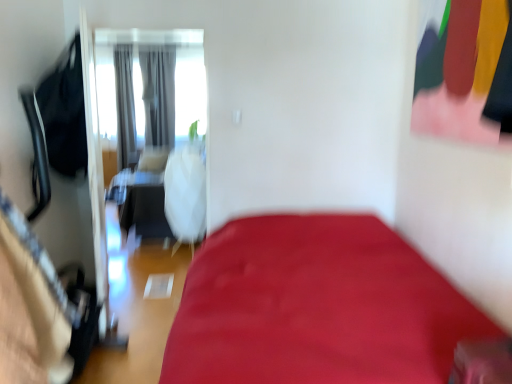
In order to face gray fabric curtain at center, the 1th curtain viewed from the right, should I rotate leftwards or rightwards?

To align with it, rotate left about 13.038°.

In the scene shown: What is the approximate height of gray fabric curtain at center, the 2th curtain in the left-to-right sequence?

The height of gray fabric curtain at center, the 2th curtain in the left-to-right sequence, is 5.85 feet.

I want to click on gray fabric curtain at center, the 1th curtain viewed from the right, so click(x=158, y=93).

From the image's perspective, relative to gray fabric curtain at center, the 2th curtain in the left-to-right sequence, is gray fabric curtain at upper left, the 1th curtain in the left-to-right sequence, above or below?

From the image's perspective, gray fabric curtain at upper left, the 1th curtain in the left-to-right sequence, appears below gray fabric curtain at center, the 2th curtain in the left-to-right sequence.

Can you see gray fabric curtain at upper left, which appears as the 2th curtain when viewed from the right, touching gray fabric curtain at center, the 2th curtain in the left-to-right sequence?

No, gray fabric curtain at upper left, which appears as the 2th curtain when viewed from the right, is not next to gray fabric curtain at center, the 2th curtain in the left-to-right sequence.

Considering the relative positions of gray fabric curtain at upper left, which appears as the 2th curtain when viewed from the right, and gray fabric curtain at center, the 2th curtain in the left-to-right sequence, in the image provided, is gray fabric curtain at upper left, which appears as the 2th curtain when viewed from the right, to the left or to the right of gray fabric curtain at center, the 2th curtain in the left-to-right sequence,?

gray fabric curtain at upper left, which appears as the 2th curtain when viewed from the right, is to the left of gray fabric curtain at center, the 2th curtain in the left-to-right sequence.

At what (x,y) coordinates should I click in order to perform the action: click on curtain on the right of gray fabric curtain at upper left, the 1th curtain in the left-to-right sequence. Please return your answer as a coordinate pair (x, y). Looking at the image, I should click on (158, 93).

From the image's perspective, does matte black clothing at upper right appear lower than white matte screen door at upper left?

No, from the image's perspective, matte black clothing at upper right is not beneath white matte screen door at upper left.

Is matte black clothing at upper right far away from white matte screen door at upper left?

Indeed, matte black clothing at upper right is not near white matte screen door at upper left.

What's the angular difference between matte black clothing at upper right and white matte screen door at upper left's facing directions?

The angle between the facing direction of matte black clothing at upper right and the facing direction of white matte screen door at upper left is 89.9 degrees.

Which of these two, matte black clothing at upper right or white matte screen door at upper left, is smaller?

Smaller between the two is matte black clothing at upper right.

Consider the image. Can you tell me how much matte black clothing at upper right and gray fabric curtain at center, the 2th curtain in the left-to-right sequence, differ in facing direction?

The angle between the facing direction of matte black clothing at upper right and the facing direction of gray fabric curtain at center, the 2th curtain in the left-to-right sequence, is 93.3 degrees.

From a real-world perspective, who is located higher, matte black clothing at upper right or gray fabric curtain at center, the 2th curtain in the left-to-right sequence?

From a 3D spatial view, matte black clothing at upper right is above.

This screenshot has height=384, width=512. What are the coordinates of `the 1st curtain below the matte black clothing at upper right (from a real-world perspective)` in the screenshot? It's located at (158, 93).

In the scene shown: Is matte black clothing at upper right inside the boundaries of gray fabric curtain at center, the 1th curtain viewed from the right, or outside?

matte black clothing at upper right is not inside gray fabric curtain at center, the 1th curtain viewed from the right, it's outside.

From the image's perspective, would you say gray fabric curtain at center, the 2th curtain in the left-to-right sequence, is shown under gray fabric curtain at upper left, the 1th curtain in the left-to-right sequence?

No, from the image's perspective, gray fabric curtain at center, the 2th curtain in the left-to-right sequence, is not beneath gray fabric curtain at upper left, the 1th curtain in the left-to-right sequence.

Considering the positions of points (156, 60) and (121, 103), is point (156, 60) farther from camera compared to point (121, 103)?

Yes, point (156, 60) is behind point (121, 103).

Locate an element on the screen. The width and height of the screenshot is (512, 384). curtain lying behind the gray fabric curtain at upper left, which appears as the 2th curtain when viewed from the right is located at coordinates (158, 93).

Looking at their sizes, would you say gray fabric curtain at center, the 1th curtain viewed from the right, is wider or thinner than gray fabric curtain at upper left, which appears as the 2th curtain when viewed from the right?

Clearly, gray fabric curtain at center, the 1th curtain viewed from the right, has less width compared to gray fabric curtain at upper left, which appears as the 2th curtain when viewed from the right.

Looking at this image, is white matte screen door at upper left next to matte black clothing at upper right and touching it?

No, white matte screen door at upper left is not touching matte black clothing at upper right.

From a real-world perspective, is white matte screen door at upper left positioned under matte black clothing at upper right based on gravity?

Correct, in the physical world, white matte screen door at upper left is lower than matte black clothing at upper right.

Considering the positions of point (134, 144) and point (474, 19), is point (134, 144) closer or farther from the camera than point (474, 19)?

Point (134, 144).

From a real-world perspective, which object stands above the other?

matte black clothing at upper right, from a real-world perspective.

What's the angular difference between gray fabric curtain at upper left, which appears as the 2th curtain when viewed from the right, and matte black clothing at upper right's facing directions?

They differ by 93.3 degrees in their facing directions.

Which of these two, gray fabric curtain at upper left, which appears as the 2th curtain when viewed from the right, or matte black clothing at upper right, is bigger?

Bigger between the two is gray fabric curtain at upper left, which appears as the 2th curtain when viewed from the right.

Is gray fabric curtain at upper left, the 1th curtain in the left-to-right sequence, completely or partially outside of white matte screen door at upper left?

Yes, gray fabric curtain at upper left, the 1th curtain in the left-to-right sequence, is outside of white matte screen door at upper left.

From the image's perspective, who appears lower, gray fabric curtain at upper left, the 1th curtain in the left-to-right sequence, or white matte screen door at upper left?

white matte screen door at upper left.

Is the position of gray fabric curtain at upper left, the 1th curtain in the left-to-right sequence, more distant than that of white matte screen door at upper left?

Yes, gray fabric curtain at upper left, the 1th curtain in the left-to-right sequence, is behind white matte screen door at upper left.

The width and height of the screenshot is (512, 384). What are the coordinates of `curtain above the gray fabric curtain at upper left, which appears as the 2th curtain when viewed from the right (from the image's perspective)` in the screenshot? It's located at click(158, 93).

Locate an element on the screen. This screenshot has height=384, width=512. clothing above the white matte screen door at upper left (from a real-world perspective) is located at coordinates (465, 72).

Based on their spatial positions, is white matte screen door at upper left or matte black clothing at upper right closer to gray fabric curtain at upper left, the 1th curtain in the left-to-right sequence?

white matte screen door at upper left is closer to gray fabric curtain at upper left, the 1th curtain in the left-to-right sequence.

From the image, which object appears to be farther from matte black clothing at upper right, white matte screen door at upper left or gray fabric curtain at center, the 1th curtain viewed from the right?

gray fabric curtain at center, the 1th curtain viewed from the right, lies further to matte black clothing at upper right than the other object.

Estimate the real-world distances between objects in this image. Which object is closer to gray fabric curtain at upper left, which appears as the 2th curtain when viewed from the right, gray fabric curtain at center, the 2th curtain in the left-to-right sequence, or white matte screen door at upper left?

white matte screen door at upper left lies closer to gray fabric curtain at upper left, which appears as the 2th curtain when viewed from the right, than the other object.

In the scene shown: Considering their positions, is matte black clothing at upper right positioned further to white matte screen door at upper left than gray fabric curtain at center, the 2th curtain in the left-to-right sequence?

The object further to white matte screen door at upper left is matte black clothing at upper right.

When comparing their distances from gray fabric curtain at upper left, which appears as the 2th curtain when viewed from the right, does gray fabric curtain at center, the 2th curtain in the left-to-right sequence, or matte black clothing at upper right seem closer?

The object closer to gray fabric curtain at upper left, which appears as the 2th curtain when viewed from the right, is gray fabric curtain at center, the 2th curtain in the left-to-right sequence.

Based on their spatial positions, is white matte screen door at upper left or matte black clothing at upper right closer to gray fabric curtain at center, the 2th curtain in the left-to-right sequence?

white matte screen door at upper left is closer to gray fabric curtain at center, the 2th curtain in the left-to-right sequence.

Estimate the real-world distances between objects in this image. Which object is closer to white matte screen door at upper left, gray fabric curtain at center, the 2th curtain in the left-to-right sequence, or gray fabric curtain at upper left, which appears as the 2th curtain when viewed from the right?

The object closer to white matte screen door at upper left is gray fabric curtain at center, the 2th curtain in the left-to-right sequence.

Based on their spatial positions, is white matte screen door at upper left or gray fabric curtain at upper left, the 1th curtain in the left-to-right sequence, further from matte black clothing at upper right?

gray fabric curtain at upper left, the 1th curtain in the left-to-right sequence.

The height and width of the screenshot is (384, 512). Find the location of `curtain between matte black clothing at upper right and gray fabric curtain at center, the 2th curtain in the left-to-right sequence, from front to back`. curtain between matte black clothing at upper right and gray fabric curtain at center, the 2th curtain in the left-to-right sequence, from front to back is located at coordinates (125, 108).

You are a GUI agent. You are given a task and a screenshot of the screen. Output one action in this format:
    pyautogui.click(x=<x>, y=<y>)
    Task: Click on the screen door positioned between matte black clothing at upper right and gray fabric curtain at upper left, the 1th curtain in the left-to-right sequence, from near to far
    This screenshot has width=512, height=384.
    Given the screenshot: What is the action you would take?
    pyautogui.click(x=149, y=122)

Find the location of a particular element. curtain between white matte screen door at upper left and gray fabric curtain at center, the 1th curtain viewed from the right, from front to back is located at coordinates (125, 108).

Find the location of a particular element. The image size is (512, 384). screen door between matte black clothing at upper right and gray fabric curtain at center, the 2th curtain in the left-to-right sequence, from front to back is located at coordinates (149, 122).